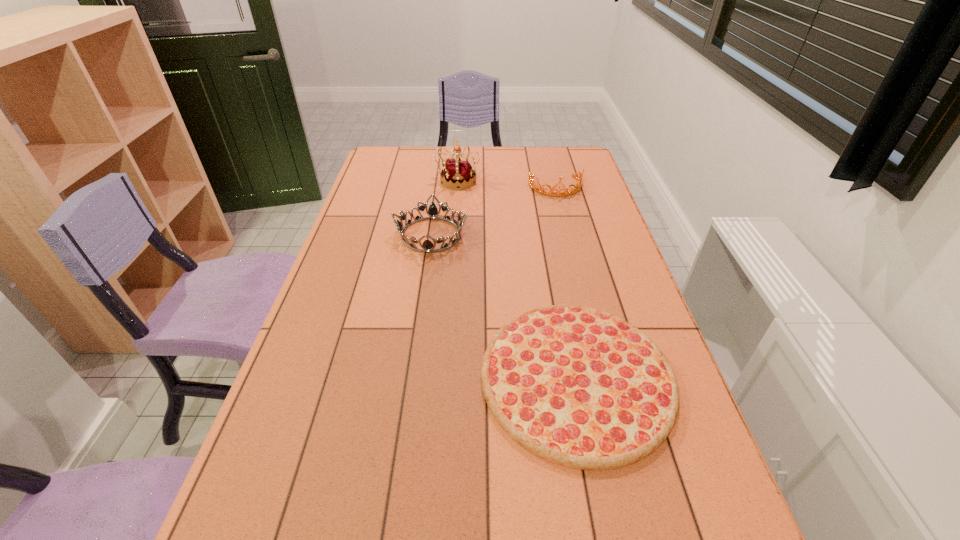
This screenshot has height=540, width=960. I want to click on the tallest object, so click(x=458, y=173).

You are a GUI agent. You are given a task and a screenshot of the screen. Output one action in this format:
    pyautogui.click(x=<x>, y=<y>)
    Task: Click on the rightmost tiara
    This screenshot has height=540, width=960.
    Given the screenshot: What is the action you would take?
    pyautogui.click(x=542, y=190)

The height and width of the screenshot is (540, 960). Find the location of `the nearest tiara`. the nearest tiara is located at coordinates (432, 212).

Where is `the shortest object`? Image resolution: width=960 pixels, height=540 pixels. the shortest object is located at coordinates (579, 387).

This screenshot has height=540, width=960. In order to click on the nearest object in this screenshot , I will do `click(579, 387)`.

The height and width of the screenshot is (540, 960). I want to click on free location located on the front-facing side of the tallest tiara, so click(x=456, y=204).

Where is `vacant space situated 0.060m on the front-facing side of the rightmost tiara`? Image resolution: width=960 pixels, height=540 pixels. vacant space situated 0.060m on the front-facing side of the rightmost tiara is located at coordinates (561, 207).

The height and width of the screenshot is (540, 960). I want to click on vacant position located on the front-facing side of the nearest tiara, so coord(424,282).

At what (x,y) coordinates should I click in order to perform the action: click on vacant region located on the left of the nearest object. Please return your answer as a coordinate pair (x, y). Looking at the image, I should click on (302, 377).

You are a GUI agent. You are given a task and a screenshot of the screen. Output one action in this format:
    pyautogui.click(x=<x>, y=<y>)
    Task: Click on the object situated at the far edge
    
    Given the screenshot: What is the action you would take?
    pyautogui.click(x=458, y=173)